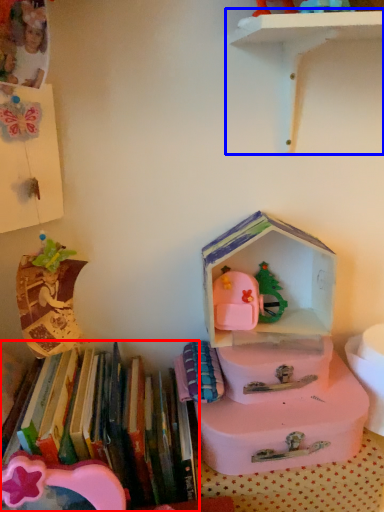
Question: Among these objects, which one is farthest to the camera, book (highlighted by a red box) or shelf (highlighted by a blue box)?

Choices:
 (A) book
 (B) shelf

Answer: (A)